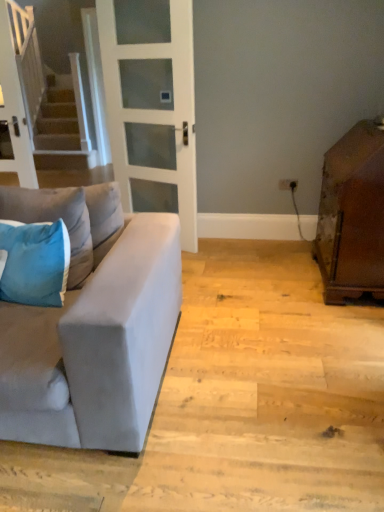
Question: Considering the relative positions of blue fabric pillow at left, the first pillow in the bottom-to-top sequence, and blue velvet pillow at left, arranged as the 1th pillow when viewed from the top, in the image provided, is blue fabric pillow at left, the first pillow in the bottom-to-top sequence, to the left or to the right of blue velvet pillow at left, arranged as the 1th pillow when viewed from the top,?

Choices:
 (A) left
 (B) right

Answer: (A)

Question: In terms of size, does blue fabric pillow at left, the first pillow in the bottom-to-top sequence, appear bigger or smaller than blue velvet pillow at left, which is the second pillow from bottom to top?

Choices:
 (A) big
 (B) small

Answer: (B)

Question: Which object is positioned farthest from the brown wooden cabinet at right?

Choices:
 (A) suede gray couch at left
 (B) blue fabric pillow at left, the first pillow in the bottom-to-top sequence
 (C) blue velvet pillow at left, which is the second pillow from bottom to top
 (D) white frosted glass door at center

Answer: (B)

Question: Which object is positioned farthest from the blue velvet pillow at left, arranged as the 1th pillow when viewed from the top?

Choices:
 (A) brown wooden cabinet at right
 (B) blue fabric pillow at left, placed as the 2th pillow when sorted from top to bottom
 (C) white frosted glass door at center
 (D) suede gray couch at left

Answer: (A)